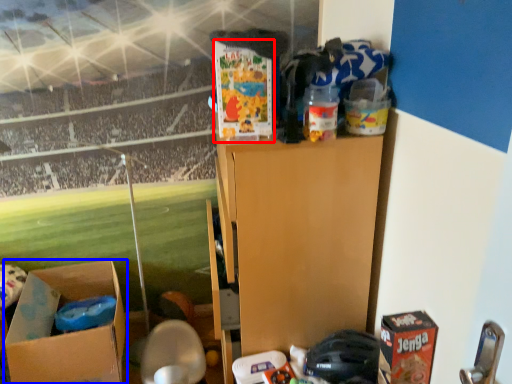
Question: Which of the following is the farthest to the observer, box (highlighted by a red box) or box (highlighted by a blue box)?

Choices:
 (A) box
 (B) box

Answer: (B)